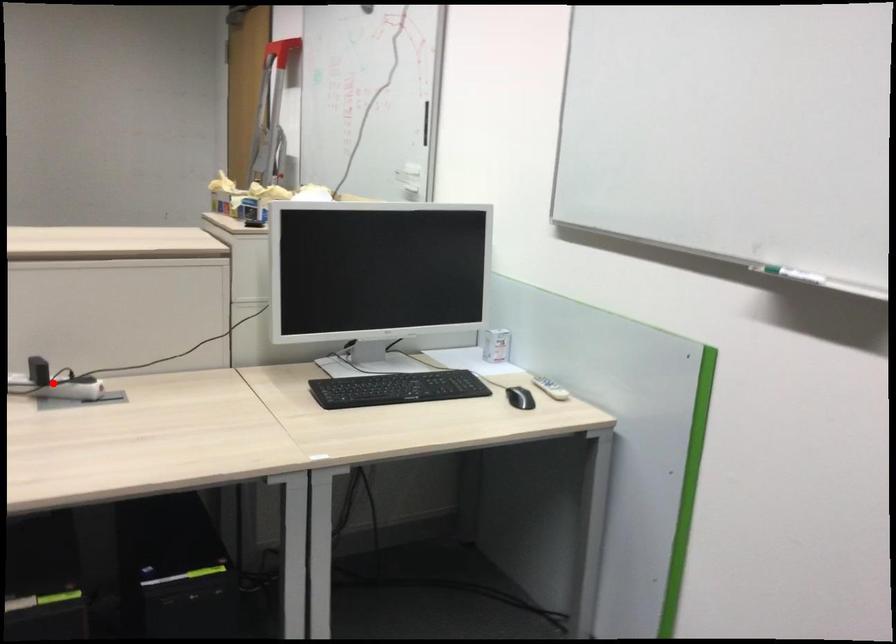
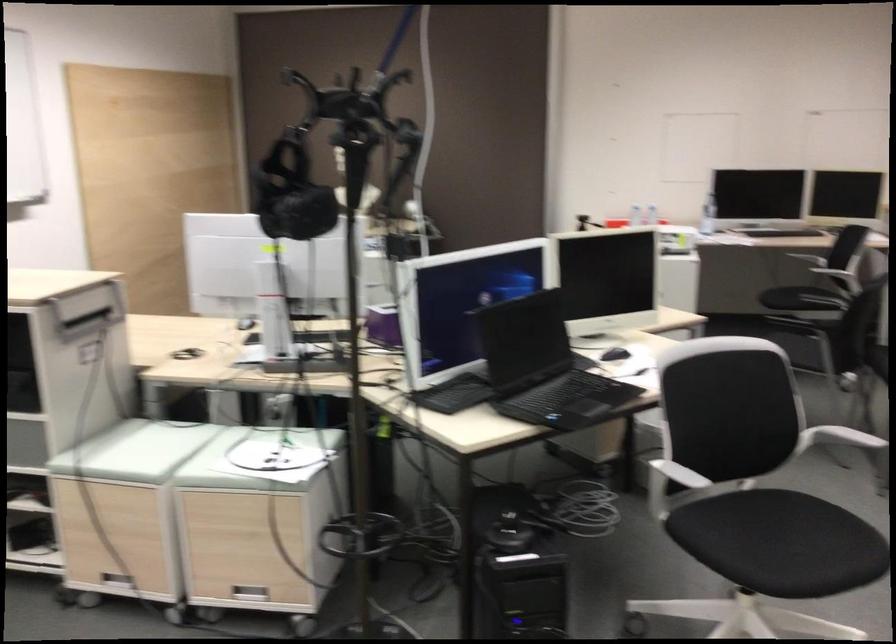
Question: I am providing you with two images of the same scene from different viewpoints. A red point is marked on the first image. At the location where the point appears in image 1, is it still visible in image 2?

Choices:
 (A) Yes
 (B) No

Answer: (B)